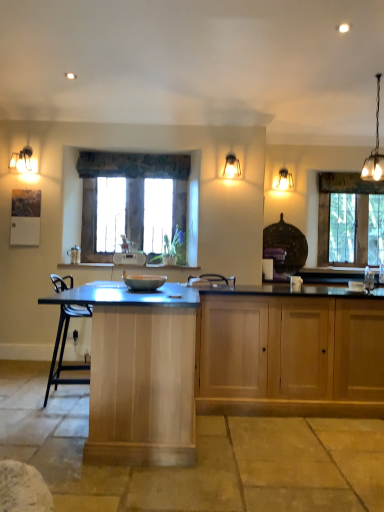
Question: Should I look upward or downward to see clear glass window at right, marked as the 1th window in a back-to-front arrangement?

Choices:
 (A) down
 (B) up

Answer: (B)

Question: Does clear glass window at right, which is counted as the 2th window, starting from the front, have a lesser width compared to wooden cabinet at lower right, which is the second cabinetry in left-to-right order?

Choices:
 (A) no
 (B) yes

Answer: (B)

Question: Is wooden cabinet at lower right, which is the second cabinetry in left-to-right order, completely or partially inside clear glass window at right, which is the 1th window from right to left?

Choices:
 (A) no
 (B) yes

Answer: (A)

Question: From a real-world perspective, does clear glass window at right, marked as the 1th window in a back-to-front arrangement, sit lower than wooden cabinet at lower right, which is the second cabinetry in left-to-right order?

Choices:
 (A) yes
 (B) no

Answer: (B)

Question: From the image's perspective, is clear glass window at right, arranged as the 2th window when viewed from the left, above wooden cabinet at lower right, which is the first cabinetry from right to left?

Choices:
 (A) no
 (B) yes

Answer: (B)

Question: Could you tell me if clear glass window at right, arranged as the 2th window when viewed from the left, is turned towards wooden cabinet at lower right, which is the second cabinetry in left-to-right order?

Choices:
 (A) no
 (B) yes

Answer: (A)

Question: From the image's perspective, is clear glass window at right, which is counted as the 2th window, starting from the front, under wooden cabinet at lower right, which is the first cabinetry from right to left?

Choices:
 (A) yes
 (B) no

Answer: (B)

Question: Can you confirm if matte white pendant light at upper left, which is the third lamp from right to left, is taller than light wood cabinet at center, which is the first cabinetry in left-to-right order?

Choices:
 (A) yes
 (B) no

Answer: (B)

Question: Does matte white pendant light at upper left, the 1th lamp from the front, lie in front of light wood cabinet at center, marked as the 2th cabinetry in a right-to-left arrangement?

Choices:
 (A) no
 (B) yes

Answer: (A)

Question: Considering the relative sizes of matte white pendant light at upper left, which is the third lamp from right to left, and light wood cabinet at center, which is the first cabinetry in left-to-right order, in the image provided, is matte white pendant light at upper left, which is the third lamp from right to left, shorter than light wood cabinet at center, which is the first cabinetry in left-to-right order,?

Choices:
 (A) no
 (B) yes

Answer: (B)

Question: Does matte white pendant light at upper left, which is the third lamp from right to left, appear on the left side of light wood cabinet at center, which is the first cabinetry in left-to-right order?

Choices:
 (A) yes
 (B) no

Answer: (A)

Question: Is matte white pendant light at upper left, acting as the first lamp starting from the left, surrounding light wood cabinet at center, which is the first cabinetry in left-to-right order?

Choices:
 (A) yes
 (B) no

Answer: (B)

Question: Is matte white pendant light at upper left, placed as the 3th lamp when sorted from back to front, facing away from light wood cabinet at center, which is the first cabinetry in left-to-right order?

Choices:
 (A) yes
 (B) no

Answer: (B)

Question: Is matte gray bowl at center oriented away from wooden cabinet at lower right, which is the second cabinetry in left-to-right order?

Choices:
 (A) no
 (B) yes

Answer: (A)